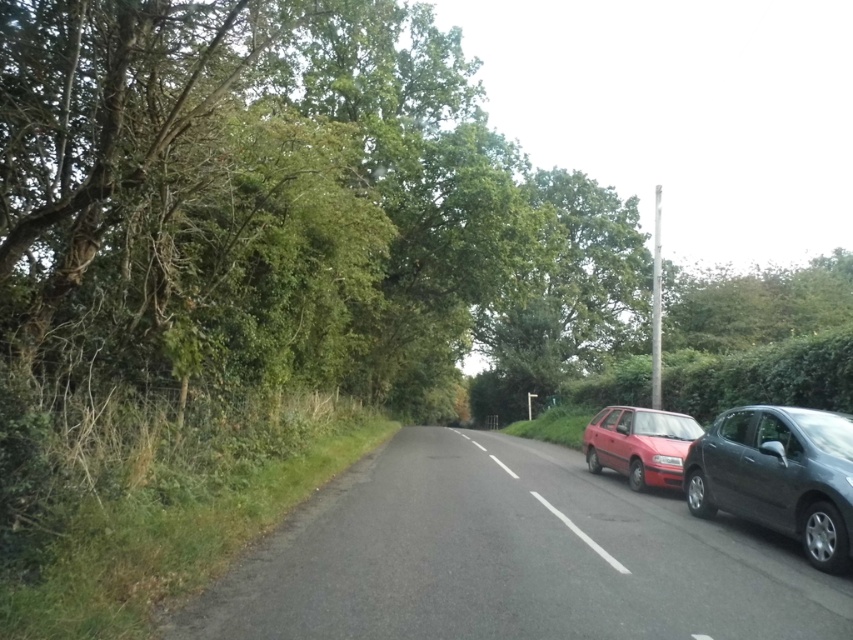
Question: Which point is closer to the camera?

Choices:
 (A) (781, 444)
 (B) (527, 336)

Answer: (A)

Question: Among these objects, which one is farthest from the camera?

Choices:
 (A) red plastic license plate at center
 (B) metallic gray hatchback at right
 (C) matte red hatchback at center-right

Answer: (C)

Question: From the image, what is the correct spatial relationship of green leafy tree at center in relation to metallic gray hatchback at right?

Choices:
 (A) below
 (B) above

Answer: (B)

Question: Is matte red hatchback at center-right bigger than red plastic license plate at center?

Choices:
 (A) yes
 (B) no

Answer: (A)

Question: Is green leafy tree at center positioned at the back of red plastic license plate at center?

Choices:
 (A) yes
 (B) no

Answer: (A)

Question: Which object appears closest to the camera in this image?

Choices:
 (A) metallic gray hatchback at right
 (B) green leafy tree at center
 (C) matte red hatchback at center-right

Answer: (A)